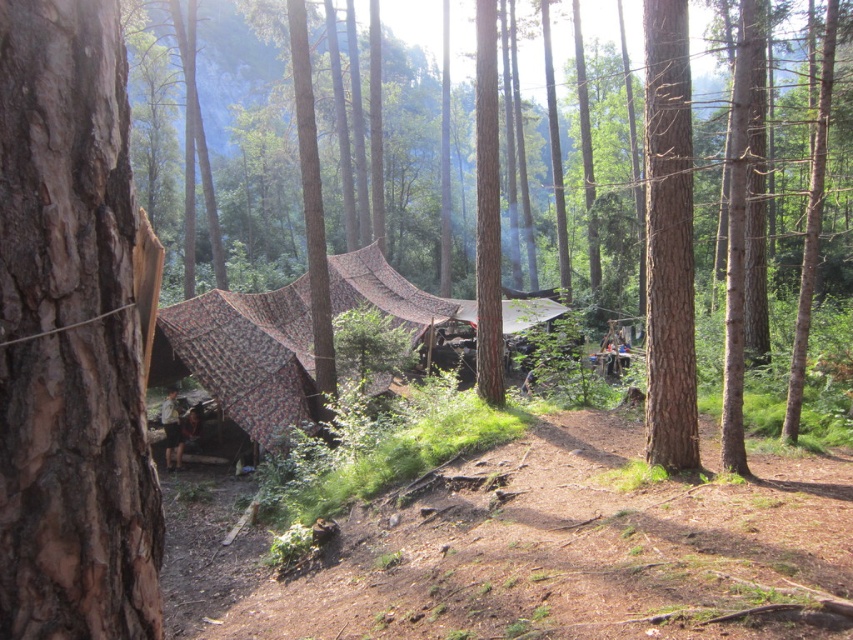
Question: Is brown rough bark tree at left smaller than smooth brown tree trunk at right?

Choices:
 (A) yes
 (B) no

Answer: (B)

Question: Which of the following is the closest to the observer?

Choices:
 (A) brown rough bark tree at left
 (B) brown rough bark at left
 (C) brown dirt track at center
 (D) smooth brown tree trunk at right

Answer: (B)

Question: Observing the image, what is the correct spatial positioning of brown dirt track at center in reference to brown rough bark tree at left?

Choices:
 (A) below
 (B) above

Answer: (A)

Question: Considering the relative positions of brown rough bark tree at left and smooth brown tree trunk at right in the image provided, where is brown rough bark tree at left located with respect to smooth brown tree trunk at right?

Choices:
 (A) right
 (B) left

Answer: (A)

Question: Which point is farther to the camera?

Choices:
 (A) brown rough bark tree at left
 (B) smooth brown tree trunk at right

Answer: (B)

Question: Which object is the closest to the smooth brown tree trunk at right?

Choices:
 (A) brown rough bark tree at left
 (B) brown dirt track at center
 (C) brown rough bark at left

Answer: (B)